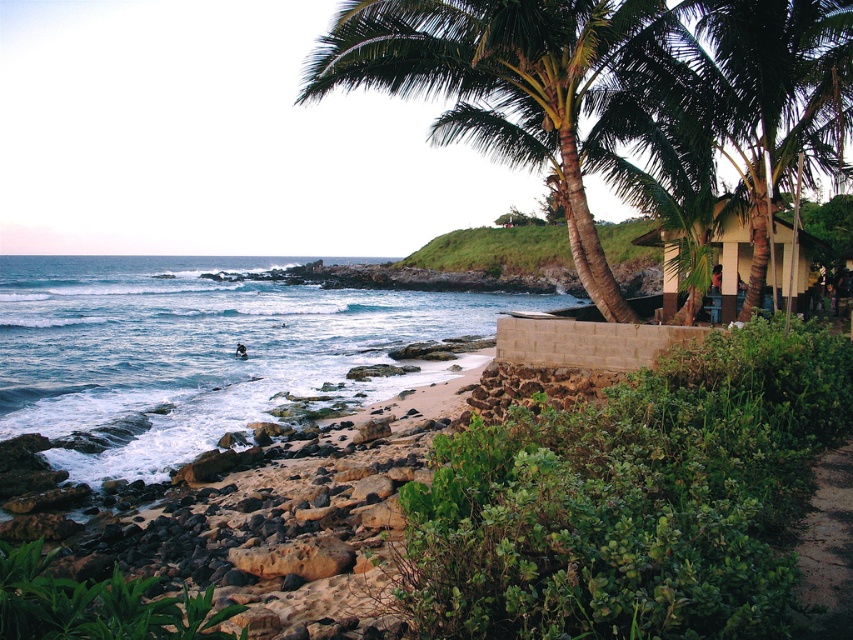
Between blue water at lower left and green leafy palm tree at upper right, which one is positioned lower?

green leafy palm tree at upper right is lower down.

Is blue water at lower left further to the viewer compared to green leafy palm tree at upper right?

Yes, it is.

The height and width of the screenshot is (640, 853). In order to click on blue water at lower left in this screenshot , I will do point(196,349).

Who is higher up, brown wooden hut at right or green grass at lower right?

Positioned higher is brown wooden hut at right.

Is brown wooden hut at right bigger than green grass at lower right?

Correct, brown wooden hut at right is larger in size than green grass at lower right.

Which is in front, point (799, 292) or point (839, 490)?

Point (839, 490)

At what (x,y) coordinates should I click in order to perform the action: click on brown wooden hut at right. Please return your answer as a coordinate pair (x, y). The height and width of the screenshot is (640, 853). Looking at the image, I should click on (756, 259).

Is blue water at lower left shorter than brown wooden hut at right?

Incorrect, blue water at lower left's height does not fall short of brown wooden hut at right's.

Is point (86, 260) positioned after point (718, 305)?

Yes, point (86, 260) is behind point (718, 305).

Locate an element on the screen. This screenshot has height=640, width=853. blue water at lower left is located at coordinates (196, 349).

Find the location of `blue water at lower left`. blue water at lower left is located at coordinates (196, 349).